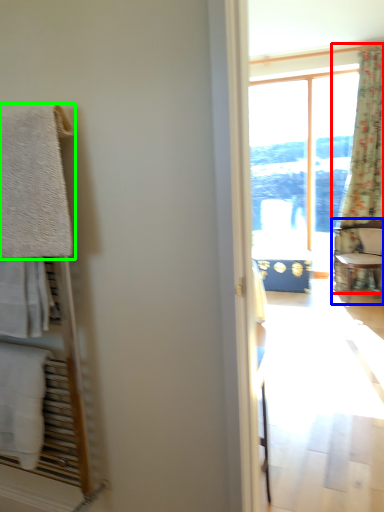
Question: Which object is the closest to the curtain (highlighted by a red box)? Choose among these: chair (highlighted by a blue box) or towel/napkin (highlighted by a green box).

Choices:
 (A) chair
 (B) towel/napkin

Answer: (A)